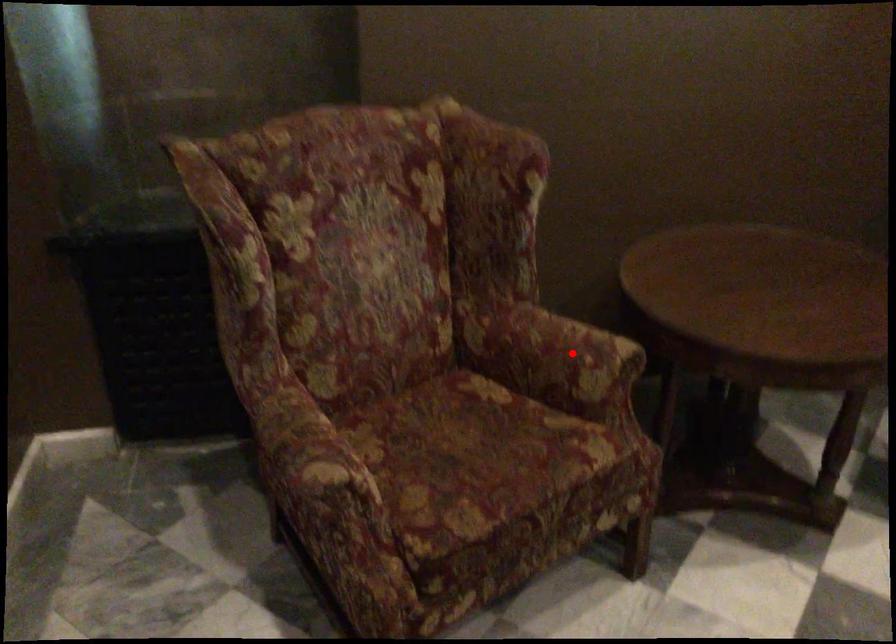
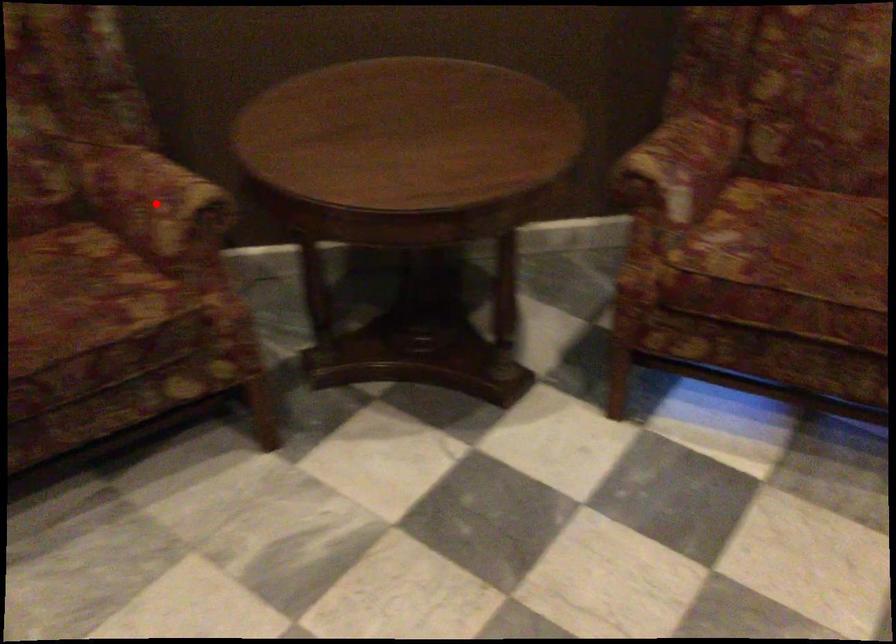
I am providing you with two images of the same scene from different viewpoints. A red point is marked on the first image and another point is marked on the second image. Is the marked point in image1 the same physical position as the marked point in image2?

Yes